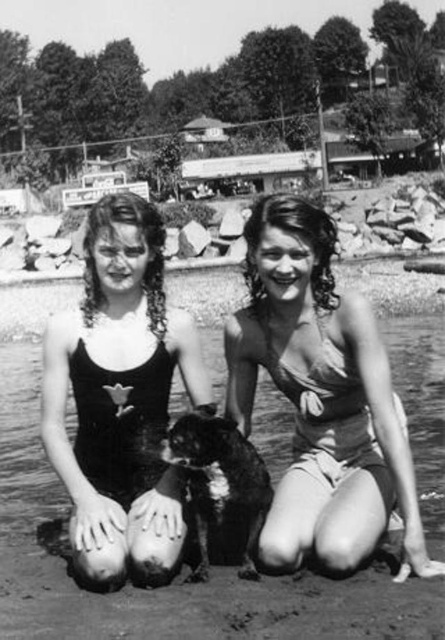
Question: Which is nearer to the shiny black fur at center?

Choices:
 (A) smooth beige swimsuit at center
 (B) black matte water at center

Answer: (A)

Question: Can you confirm if smooth beige swimsuit at center is positioned to the right of shiny black fur at center?

Choices:
 (A) no
 (B) yes

Answer: (B)

Question: Which of the following is the farthest from the observer?

Choices:
 (A) black matte swimsuit at center
 (B) shiny black fur at center
 (C) smooth beige swimsuit at center

Answer: (A)

Question: Does black matte water at center appear over shiny black fur at center?

Choices:
 (A) no
 (B) yes

Answer: (A)

Question: Which point is closer to the camera taking this photo?

Choices:
 (A) (13, 433)
 (B) (94, 230)

Answer: (B)

Question: Can you confirm if black matte water at center is positioned below smooth beige swimsuit at center?

Choices:
 (A) no
 (B) yes

Answer: (B)